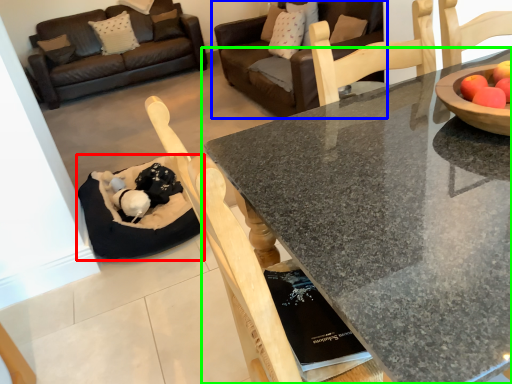
Question: Estimate the real-world distances between objects in this image. Which object is closer to cat bed (highlighted by a red box), studio couch (highlighted by a blue box) or coffee table (highlighted by a green box)?

Choices:
 (A) studio couch
 (B) coffee table

Answer: (B)